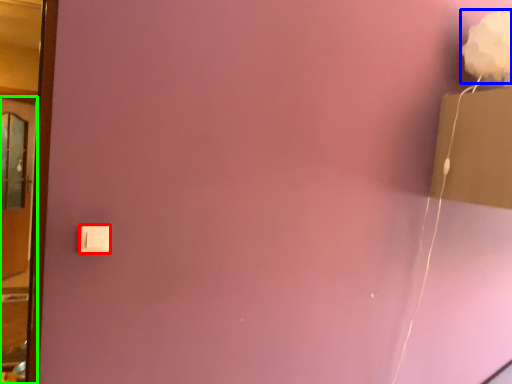
Question: Which object is the closest to the light switch (highlighted by a red box)? Choose among these: flower (highlighted by a blue box) or door (highlighted by a green box).

Choices:
 (A) flower
 (B) door

Answer: (A)